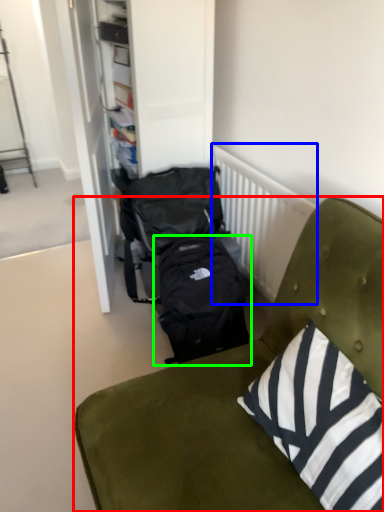
Question: Which object is the closest to the furniture (highlighted by a red box)? Choose among these: radiator (highlighted by a blue box) or backpack (highlighted by a green box).

Choices:
 (A) radiator
 (B) backpack

Answer: (B)